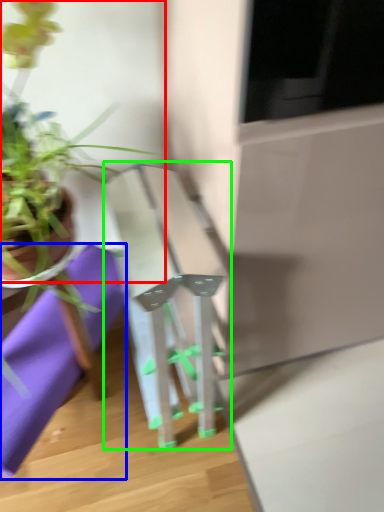
Question: Which object is positioned farthest from houseplant (highlighted by a red box)? Select from cloth (highlighted by a blue box) and table (highlighted by a green box).

Choices:
 (A) cloth
 (B) table

Answer: (B)